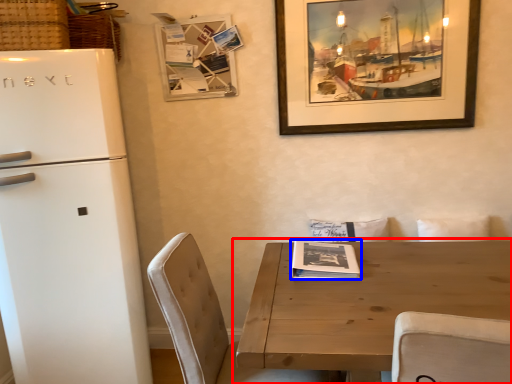
Question: Which of the following is the farthest to the observer, table (highlighted by a red box) or magazine (highlighted by a blue box)?

Choices:
 (A) table
 (B) magazine

Answer: (B)